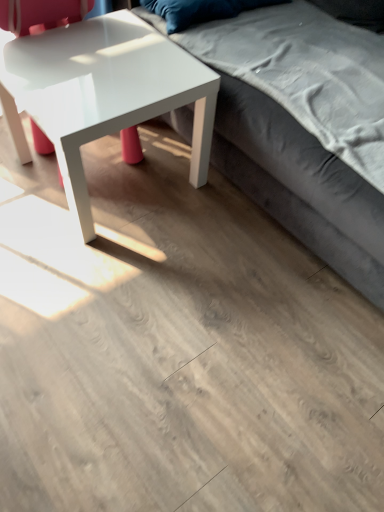
Question: From the image's perspective, is velvet gray couch at upper right beneath glossy white coffee table at left?

Choices:
 (A) yes
 (B) no

Answer: (B)

Question: Does velvet gray couch at upper right have a greater height compared to glossy white coffee table at left?

Choices:
 (A) yes
 (B) no

Answer: (A)

Question: Is velvet gray couch at upper right next to glossy white coffee table at left?

Choices:
 (A) yes
 (B) no

Answer: (B)

Question: Considering the relative positions of velvet gray couch at upper right and glossy white coffee table at left in the image provided, is velvet gray couch at upper right to the right of glossy white coffee table at left from the viewer's perspective?

Choices:
 (A) yes
 (B) no

Answer: (A)

Question: Are velvet gray couch at upper right and glossy white coffee table at left far apart?

Choices:
 (A) no
 (B) yes

Answer: (A)

Question: Is point (39, 34) positioned closer to the camera than point (319, 125)?

Choices:
 (A) closer
 (B) farther

Answer: (B)

Question: In the image, is glossy white coffee table at left positioned in front of or behind velvet gray couch at upper right?

Choices:
 (A) front
 (B) behind

Answer: (B)

Question: From the image's perspective, is glossy white coffee table at left positioned above or below velvet gray couch at upper right?

Choices:
 (A) above
 (B) below

Answer: (B)

Question: Based on their sizes in the image, would you say glossy white coffee table at left is bigger or smaller than velvet gray couch at upper right?

Choices:
 (A) big
 (B) small

Answer: (B)

Question: Is velvet gray couch at upper right wider or thinner than velvet blue pillow at upper center?

Choices:
 (A) wide
 (B) thin

Answer: (A)

Question: In the image, is velvet gray couch at upper right on the left side or the right side of velvet blue pillow at upper center?

Choices:
 (A) left
 (B) right

Answer: (B)

Question: From the image's perspective, is velvet gray couch at upper right above or below velvet blue pillow at upper center?

Choices:
 (A) below
 (B) above

Answer: (A)

Question: Is velvet gray couch at upper right spatially inside velvet blue pillow at upper center, or outside of it?

Choices:
 (A) inside
 (B) outside

Answer: (B)

Question: Is point (208, 11) closer or farther from the camera than point (261, 158)?

Choices:
 (A) closer
 (B) farther

Answer: (B)

Question: In the image, is velvet blue pillow at upper center positioned in front of or behind velvet gray couch at upper right?

Choices:
 (A) behind
 (B) front

Answer: (A)